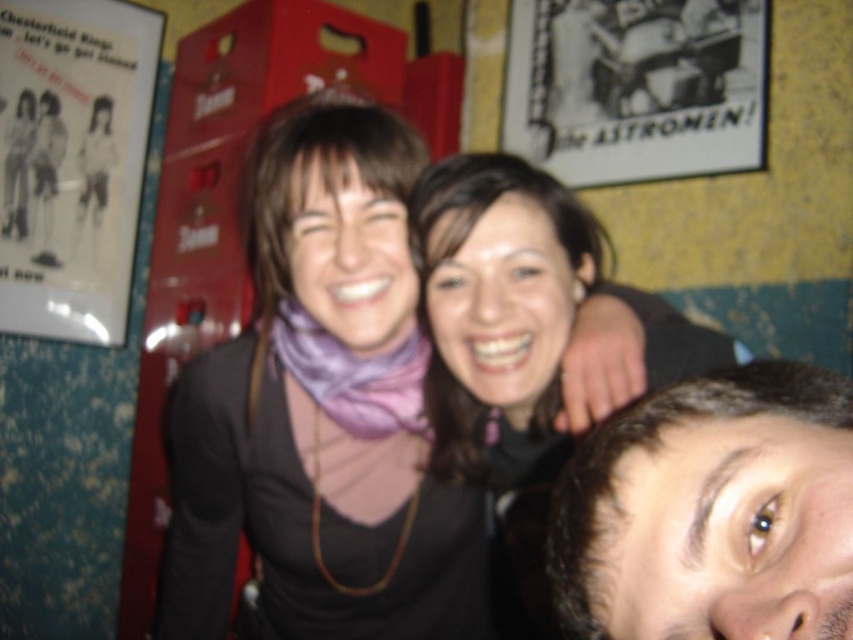
Question: Is brown hair at upper right further to the viewer compared to matte black sweater at center?

Choices:
 (A) no
 (B) yes

Answer: (A)

Question: Which of the following is the closest to the observer?

Choices:
 (A) click(578, 300)
 (B) click(730, 502)

Answer: (B)

Question: Among these objects, which one is nearest to the camera?

Choices:
 (A) matte black sweater at center
 (B) brown hair at upper right

Answer: (B)

Question: Is brown hair at upper right to the left of matte black sweater at center from the viewer's perspective?

Choices:
 (A) yes
 (B) no

Answer: (A)

Question: Does brown hair at upper right appear over matte black sweater at center?

Choices:
 (A) yes
 (B) no

Answer: (A)